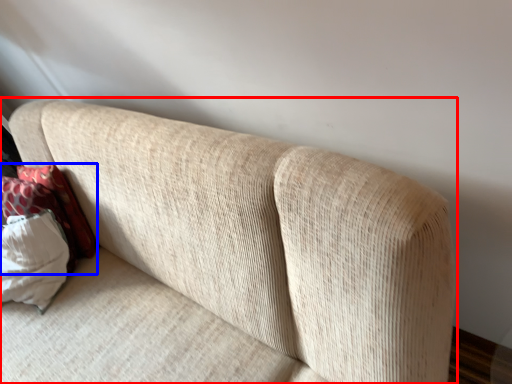
Question: Which object appears closest to the camera in this image, studio couch (highlighted by a red box) or pillow (highlighted by a blue box)?

Choices:
 (A) studio couch
 (B) pillow

Answer: (A)